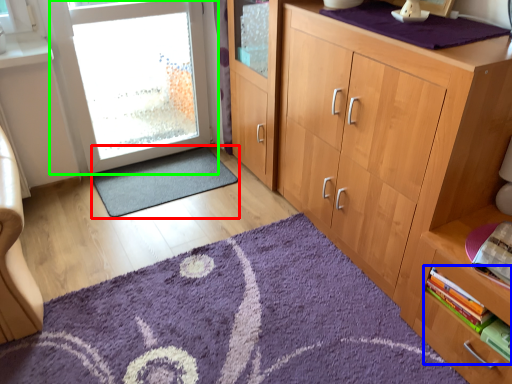
Question: Which is nearer to the doormat (highlighted by a red box)? book (highlighted by a blue box) or door (highlighted by a green box).

Choices:
 (A) book
 (B) door

Answer: (B)